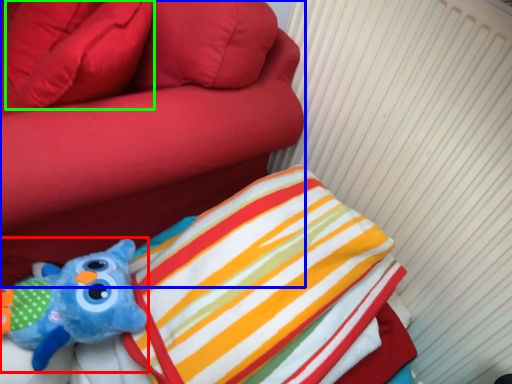
Question: Which is nearer to the toy (highlighted by a red box)? furniture (highlighted by a blue box) or pillow (highlighted by a green box).

Choices:
 (A) furniture
 (B) pillow

Answer: (A)